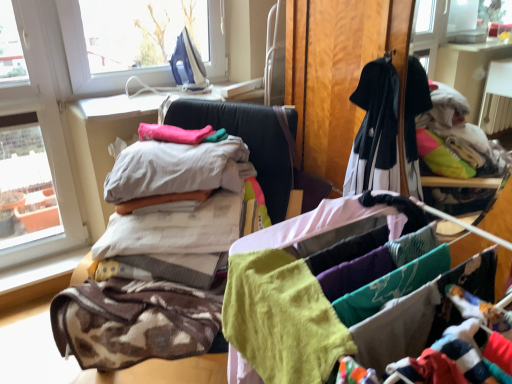
Where is `white cotton bed at center`? white cotton bed at center is located at coordinates (179, 369).

Find the location of a particular element. The width and height of the screenshot is (512, 384). white cotton sheets at center, which appears as the third baby clothe when viewed from the back is located at coordinates (174, 230).

This screenshot has height=384, width=512. In order to click on soft yellow fabric at center, marked as the 5th baby clothe in a back-to-front arrangement in this screenshot , I will do `click(279, 321)`.

Describe the element at coordinates (174, 134) in the screenshot. I see `pink fabric at center, which ranks as the fifth baby clothe in front-to-back order` at that location.

What is the approximate height of brown textured blanket at left, positioned as the second baby clothe in front-to-back order?

brown textured blanket at left, positioned as the second baby clothe in front-to-back order, is 10.23 inches in height.

Locate an element on the screen. This screenshot has width=512, height=384. white cotton bed at center is located at coordinates (179, 369).

Considering the relative sizes of brown textured blanket at left, positioned as the second baby clothe in front-to-back order, and soft cotton clothes at center, the fourth baby clothe viewed from the front, in the image provided, is brown textured blanket at left, positioned as the second baby clothe in front-to-back order, smaller than soft cotton clothes at center, the fourth baby clothe viewed from the front,?

No, brown textured blanket at left, positioned as the second baby clothe in front-to-back order, is not smaller than soft cotton clothes at center, the fourth baby clothe viewed from the front.

Does point (132, 331) appear closer or farther from the camera than point (134, 178)?

Point (132, 331) appears to be closer to the viewer than point (134, 178).

Does brown textured blanket at left, positioned as the second baby clothe in front-to-back order, touch soft cotton clothes at center, the fourth baby clothe viewed from the front?

No, brown textured blanket at left, positioned as the second baby clothe in front-to-back order, is not next to soft cotton clothes at center, the fourth baby clothe viewed from the front.

From a real-world perspective, between brown textured blanket at left, positioned as the second baby clothe in front-to-back order, and soft cotton clothes at center, the fourth baby clothe viewed from the front, who is vertically higher?

From a 3D spatial view, soft cotton clothes at center, the fourth baby clothe viewed from the front, is above.

Can you confirm if white cotton bed at center is positioned to the right of white cotton sheets at center, which appears as the third baby clothe when viewed from the back?

Yes.

From a real-world perspective, between white cotton bed at center and white cotton sheets at center, which appears as the third baby clothe when viewed from the back, who is vertically lower?

white cotton bed at center, from a real-world perspective.

Is there a large distance between white cotton bed at center and white cotton sheets at center, which is counted as the 3th baby clothe, starting from the front?

No.

Which object is further away from the camera taking this photo, white cotton bed at center or white cotton sheets at center, which is counted as the 3th baby clothe, starting from the front?

white cotton sheets at center, which is counted as the 3th baby clothe, starting from the front, is behind.

Considering the points (135, 195) and (110, 296), which point is behind, point (135, 195) or point (110, 296)?

The point (135, 195) is farther from the camera.

Based on their sizes in the image, would you say soft cotton clothes at center, the fourth baby clothe viewed from the front, is bigger or smaller than brown textured blanket at left, positioned as the second baby clothe in front-to-back order?

Clearly, soft cotton clothes at center, the fourth baby clothe viewed from the front, is smaller in size than brown textured blanket at left, positioned as the second baby clothe in front-to-back order.

Considering the relative positions of soft cotton clothes at center, the fourth baby clothe viewed from the front, and brown textured blanket at left, which is counted as the 4th baby clothe, starting from the back, in the image provided, is soft cotton clothes at center, the fourth baby clothe viewed from the front, behind brown textured blanket at left, which is counted as the 4th baby clothe, starting from the back,?

That is True.

Does soft cotton clothes at center, the second baby clothe viewed from the back, have a greater height compared to brown textured blanket at left, which is counted as the 4th baby clothe, starting from the back?

In fact, soft cotton clothes at center, the second baby clothe viewed from the back, may be shorter than brown textured blanket at left, which is counted as the 4th baby clothe, starting from the back.

Would you say pink fabric at center, which ranks as the fifth baby clothe in front-to-back order, is outside brown textured blanket at left, positioned as the second baby clothe in front-to-back order?

pink fabric at center, which ranks as the fifth baby clothe in front-to-back order, is positioned outside brown textured blanket at left, positioned as the second baby clothe in front-to-back order.

From a real-world perspective, is pink fabric at center, the 1th baby clothe in the back-to-front sequence, positioned over brown textured blanket at left, positioned as the second baby clothe in front-to-back order, based on gravity?

Yes.

Are pink fabric at center, which ranks as the fifth baby clothe in front-to-back order, and brown textured blanket at left, which is counted as the 4th baby clothe, starting from the back, making contact?

No, pink fabric at center, which ranks as the fifth baby clothe in front-to-back order, is not touching brown textured blanket at left, which is counted as the 4th baby clothe, starting from the back.

Are white cotton sheets at center, which appears as the third baby clothe when viewed from the back, and soft yellow fabric at center, marked as the 5th baby clothe in a back-to-front arrangement, making contact?

white cotton sheets at center, which appears as the third baby clothe when viewed from the back, and soft yellow fabric at center, marked as the 5th baby clothe in a back-to-front arrangement, are clearly separated.

Considering their positions, is white cotton sheets at center, which is counted as the 3th baby clothe, starting from the front, located in front of or behind soft yellow fabric at center, marked as the 5th baby clothe in a back-to-front arrangement?

white cotton sheets at center, which is counted as the 3th baby clothe, starting from the front, is positioned farther from the viewer than soft yellow fabric at center, marked as the 5th baby clothe in a back-to-front arrangement.

Considering the sizes of objects white cotton sheets at center, which appears as the third baby clothe when viewed from the back, and soft yellow fabric at center, positioned as the first baby clothe in front-to-back order, in the image provided, who is wider, white cotton sheets at center, which appears as the third baby clothe when viewed from the back, or soft yellow fabric at center, positioned as the first baby clothe in front-to-back order,?

Wider between the two is white cotton sheets at center, which appears as the third baby clothe when viewed from the back.

Between white cotton sheets at center, which appears as the third baby clothe when viewed from the back, and soft yellow fabric at center, marked as the 5th baby clothe in a back-to-front arrangement, which one has less height?

Standing shorter between the two is soft yellow fabric at center, marked as the 5th baby clothe in a back-to-front arrangement.

Measure the distance between white cotton sheets at center, which is counted as the 3th baby clothe, starting from the front, and brown textured blanket at left, positioned as the second baby clothe in front-to-back order.

They are 7.86 inches apart.

Is white cotton sheets at center, which appears as the third baby clothe when viewed from the back, next to brown textured blanket at left, positioned as the second baby clothe in front-to-back order?

No, white cotton sheets at center, which appears as the third baby clothe when viewed from the back, is not touching brown textured blanket at left, positioned as the second baby clothe in front-to-back order.

Can you confirm if white cotton sheets at center, which appears as the third baby clothe when viewed from the back, is positioned to the right of brown textured blanket at left, positioned as the second baby clothe in front-to-back order?

Indeed, white cotton sheets at center, which appears as the third baby clothe when viewed from the back, is positioned on the right side of brown textured blanket at left, positioned as the second baby clothe in front-to-back order.

Which of these two, white cotton sheets at center, which is counted as the 3th baby clothe, starting from the front, or brown textured blanket at left, which is counted as the 4th baby clothe, starting from the back, is smaller?

white cotton sheets at center, which is counted as the 3th baby clothe, starting from the front, is smaller.

Is white cotton bed at center facing away from soft cotton clothes at center, the fourth baby clothe viewed from the front?

That's not correct — white cotton bed at center is not looking away from soft cotton clothes at center, the fourth baby clothe viewed from the front.

Is soft cotton clothes at center, the fourth baby clothe viewed from the front, a part of white cotton bed at center?

Indeed, soft cotton clothes at center, the fourth baby clothe viewed from the front, is located within white cotton bed at center.

Is white cotton bed at center positioned before soft cotton clothes at center, the second baby clothe viewed from the back?

Yes, it is.

Considering the relative sizes of white cotton bed at center and soft cotton clothes at center, the fourth baby clothe viewed from the front, in the image provided, is white cotton bed at center shorter than soft cotton clothes at center, the fourth baby clothe viewed from the front,?

No, white cotton bed at center is not shorter than soft cotton clothes at center, the fourth baby clothe viewed from the front.

Starting from the brown textured blanket at left, which is counted as the 4th baby clothe, starting from the back, which baby clothe is the 2nd one behind? Please provide its 2D coordinates.

[(177, 169)]

There is a white cotton bed at center. In order to click on the 1st baby clothe above it (from the image's perspective) in this screenshot , I will do `click(174, 230)`.

Based on their spatial positions, is pink fabric at center, which ranks as the fifth baby clothe in front-to-back order, or brown textured blanket at left, positioned as the second baby clothe in front-to-back order, closer to white cotton sheets at center, which is counted as the 3th baby clothe, starting from the front?

The object closer to white cotton sheets at center, which is counted as the 3th baby clothe, starting from the front, is brown textured blanket at left, positioned as the second baby clothe in front-to-back order.

Which object lies further to the anchor point white cotton sheets at center, which appears as the third baby clothe when viewed from the back, pink fabric at center, the 1th baby clothe in the back-to-front sequence, or white cotton bed at center?

white cotton bed at center is positioned further to the anchor white cotton sheets at center, which appears as the third baby clothe when viewed from the back.

Consider the image. Considering their positions, is brown textured blanket at left, positioned as the second baby clothe in front-to-back order, positioned further to white cotton sheets at center, which appears as the third baby clothe when viewed from the back, than pink fabric at center, which ranks as the fifth baby clothe in front-to-back order?

pink fabric at center, which ranks as the fifth baby clothe in front-to-back order.

When comparing their distances from white cotton bed at center, does brown textured blanket at left, which is counted as the 4th baby clothe, starting from the back, or pink fabric at center, which ranks as the fifth baby clothe in front-to-back order, seem further?

brown textured blanket at left, which is counted as the 4th baby clothe, starting from the back, lies further to white cotton bed at center than the other object.

From the image, which object appears to be nearer to pink fabric at center, the 1th baby clothe in the back-to-front sequence, soft cotton clothes at center, the fourth baby clothe viewed from the front, or brown textured blanket at left, positioned as the second baby clothe in front-to-back order?

soft cotton clothes at center, the fourth baby clothe viewed from the front, is closer to pink fabric at center, the 1th baby clothe in the back-to-front sequence.

Which object lies further to the anchor point soft cotton towel at center, brown textured blanket at left, positioned as the second baby clothe in front-to-back order, or soft yellow fabric at center, marked as the 5th baby clothe in a back-to-front arrangement?

brown textured blanket at left, positioned as the second baby clothe in front-to-back order, lies further to soft cotton towel at center than the other object.

Considering their positions, is soft yellow fabric at center, marked as the 5th baby clothe in a back-to-front arrangement, positioned closer to soft cotton towel at center than pink fabric at center, which ranks as the fifth baby clothe in front-to-back order?

soft yellow fabric at center, marked as the 5th baby clothe in a back-to-front arrangement, is positioned closer to the anchor soft cotton towel at center.

From the image, which object appears to be farther from pink fabric at center, which ranks as the fifth baby clothe in front-to-back order, brown textured blanket at left, positioned as the second baby clothe in front-to-back order, or soft cotton towel at center?

soft cotton towel at center is further to pink fabric at center, which ranks as the fifth baby clothe in front-to-back order.

The height and width of the screenshot is (384, 512). I want to click on furniture between soft cotton towel at center and pink fabric at center, which ranks as the fifth baby clothe in front-to-back order, from front to back, so click(179, 369).

This screenshot has height=384, width=512. What are the coordinates of `material between soft yellow fabric at center, marked as the 5th baby clothe in a back-to-front arrangement, and pink fabric at center, the 1th baby clothe in the back-to-front sequence, in the front-back direction` in the screenshot? It's located at (283, 306).

This screenshot has width=512, height=384. I want to click on furniture between soft cotton clothes at center, the fourth baby clothe viewed from the front, and brown textured blanket at left, which is counted as the 4th baby clothe, starting from the back, from top to bottom, so click(179, 369).

Locate an element on the screen. This screenshot has width=512, height=384. baby clothe between soft yellow fabric at center, marked as the 5th baby clothe in a back-to-front arrangement, and white cotton sheets at center, which appears as the third baby clothe when viewed from the back, in the front-back direction is located at coordinates (136, 322).